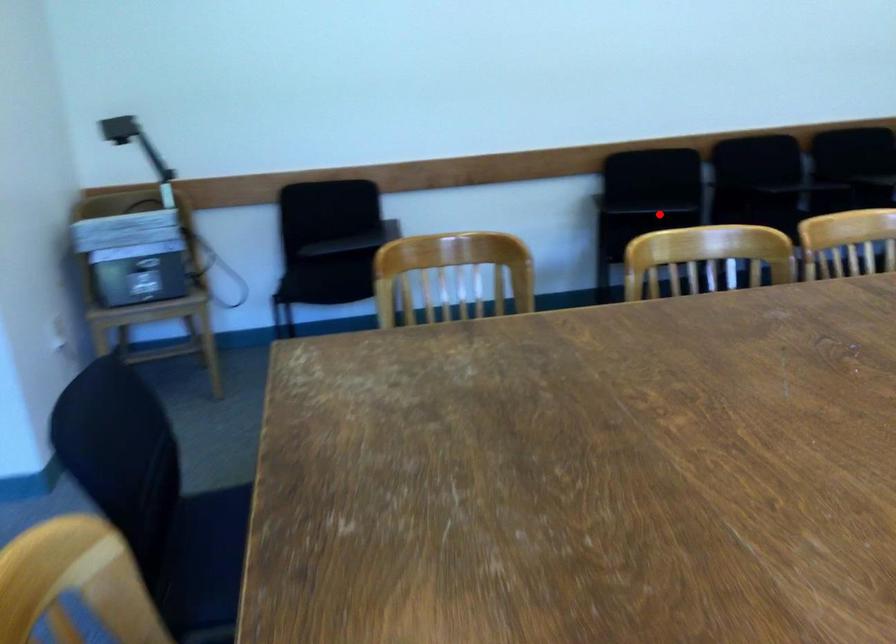
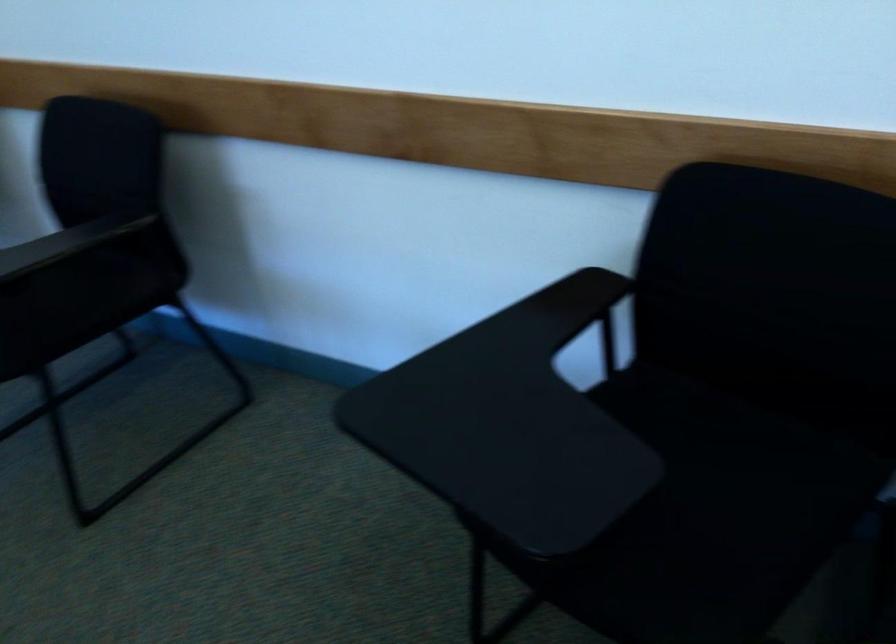
Question: I am providing you with two images of the same scene from different viewpoints. Given a red point in image1, look at the same physical point in image2. Is it:

Choices:
 (A) Closer to the viewpoint
 (B) Farther from the viewpoint

Answer: (A)